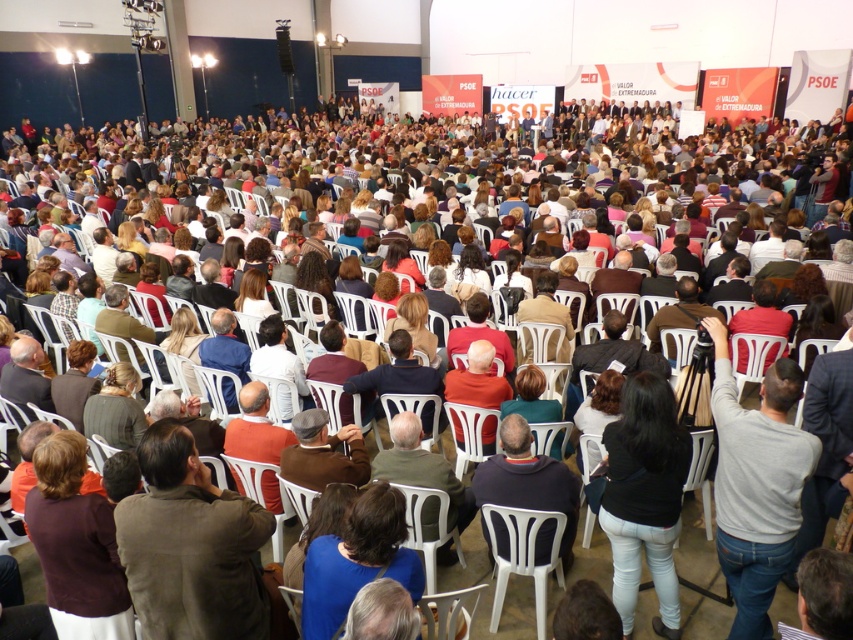
Question: Which point is closer to the camera?

Choices:
 (A) brown leather jacket at lower left
 (B) blue fabric at center
 (C) green fabric chair at center
 (D) orange fabric shirt at center

Answer: (A)

Question: Which point is farther to the camera?

Choices:
 (A) gray cotton shirt at lower right
 (B) blue fabric at center

Answer: (A)

Question: Does brown leather jacket at lower left appear over brown sweater at lower left?

Choices:
 (A) yes
 (B) no

Answer: (A)

Question: Is brown leather jacket at lower left positioned in front of blue fabric at center?

Choices:
 (A) no
 (B) yes

Answer: (B)

Question: Which point is closer to the camera taking this photo?

Choices:
 (A) (111, 632)
 (B) (152, 460)
 (C) (758, 525)
 (D) (412, 438)

Answer: (B)

Question: Can you confirm if gray cotton shirt at lower right is positioned below dark blue sweater at center?

Choices:
 (A) no
 (B) yes

Answer: (A)